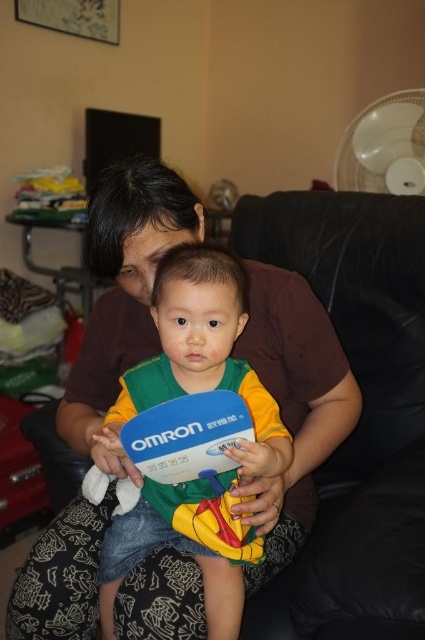
Question: Does black leather couch at center have a larger size compared to matte plastic toy at center?

Choices:
 (A) yes
 (B) no

Answer: (A)

Question: Is black leather couch at center above matte plastic toy at center?

Choices:
 (A) yes
 (B) no

Answer: (A)

Question: Which object is closer to the camera taking this photo?

Choices:
 (A) black leather couch at center
 (B) matte plastic toy at center

Answer: (B)

Question: Is black leather couch at center smaller than matte plastic toy at center?

Choices:
 (A) yes
 (B) no

Answer: (B)